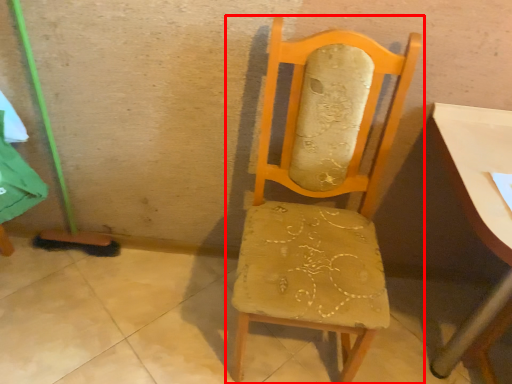
Question: From the image's perspective, what is the correct spatial positioning of chair (annotated by the red box) in reference to table?

Choices:
 (A) below
 (B) above

Answer: (B)